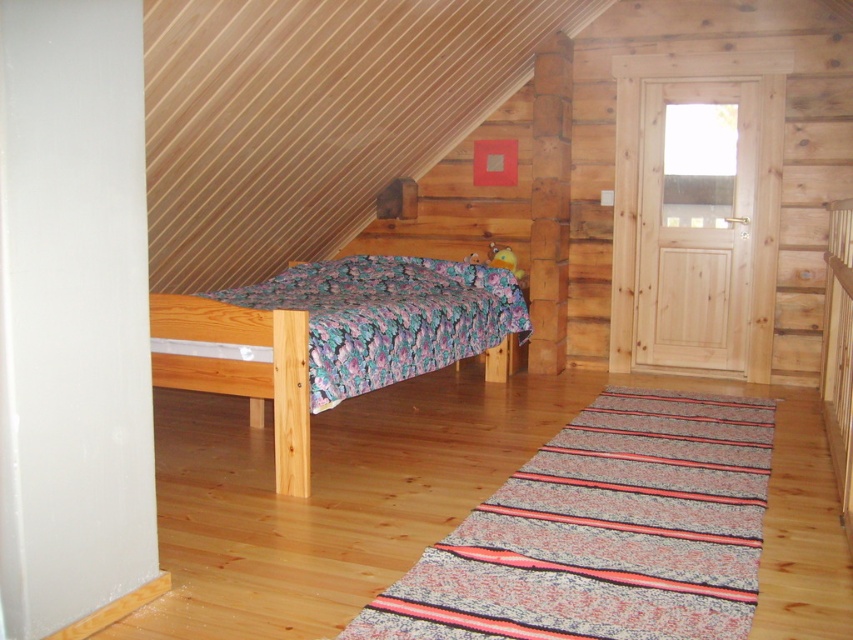
You are trying to decide whether to place a new rectangular rug in the bedroom. The rug is slightly wider than the wooden bed at center. Based on the scene, will the floral fabric quilt at center be wide enough to cover the rug if placed underneath it?

The floral fabric quilt at center is wider than the wooden bed at center. Since the rug is also wider than the wooden bed at center, the quilt may not be wide enough to fully cover the rug unless the rug is narrower than the quilt. However, since the rug is only stated to be wider than the bed, and the quilt is wider than the bed but not necessarily wider than the rug, it cannot be confirmed. The answer should reflect that the quilt is wider than the bed but the rug is also wider than the bed, so it depends

You are planning to place a new decorative pillow on the bed. Considering the sizes of the floral fabric quilt at center and the wooden bed at center, which one should you place the pillow on top of?

The floral fabric quilt at center has a smaller size compared to the wooden bed at center, so placing the decorative pillow on top of the wooden bed at center would ensure it is visible and properly accommodated.

You are a delivery person who needs to place a package that is 1.2 meters long between the floral fabric quilt at center and the wooden bed at center. Can the package fit in the space between them?

The distance between the floral fabric quilt at center and the wooden bed at center is 1.04 meters. Since the package is 1.2 meters long, it cannot fit in the available space.